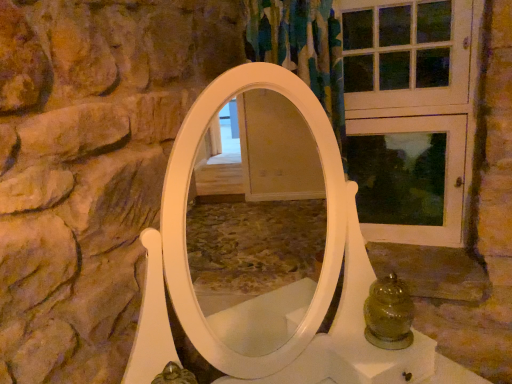
Question: Can you confirm if white wood screen door at upper right is wider than green glass jar at lower right?

Choices:
 (A) no
 (B) yes

Answer: (A)

Question: Are white wood screen door at upper right and green glass jar at lower right beside each other?

Choices:
 (A) yes
 (B) no

Answer: (B)

Question: From a real-world perspective, is white wood screen door at upper right physically above green glass jar at lower right?

Choices:
 (A) no
 (B) yes

Answer: (B)

Question: Is white wood screen door at upper right to the left of green glass jar at lower right from the viewer's perspective?

Choices:
 (A) yes
 (B) no

Answer: (B)

Question: Can you confirm if white wood screen door at upper right is positioned to the right of green glass jar at lower right?

Choices:
 (A) yes
 (B) no

Answer: (A)

Question: Can you confirm if white wood screen door at upper right is thinner than green glass jar at lower right?

Choices:
 (A) no
 (B) yes

Answer: (B)

Question: Is green glass jar at lower right not within white wood screen door at upper right?

Choices:
 (A) no
 (B) yes

Answer: (B)

Question: Can you confirm if green glass jar at lower right is smaller than white wood screen door at upper right?

Choices:
 (A) no
 (B) yes

Answer: (B)

Question: From the image's perspective, is green glass jar at lower right above white wood screen door at upper right?

Choices:
 (A) yes
 (B) no

Answer: (B)

Question: Is green glass jar at lower right at the right side of white wood screen door at upper right?

Choices:
 (A) yes
 (B) no

Answer: (B)

Question: Is green glass jar at lower right oriented away from white wood screen door at upper right?

Choices:
 (A) yes
 (B) no

Answer: (B)

Question: Is white wood screen door at upper right completely or partially inside green glass jar at lower right?

Choices:
 (A) yes
 (B) no

Answer: (B)

Question: In terms of size, does white wood screen door at upper right appear bigger or smaller than green glass jar at lower right?

Choices:
 (A) small
 (B) big

Answer: (B)